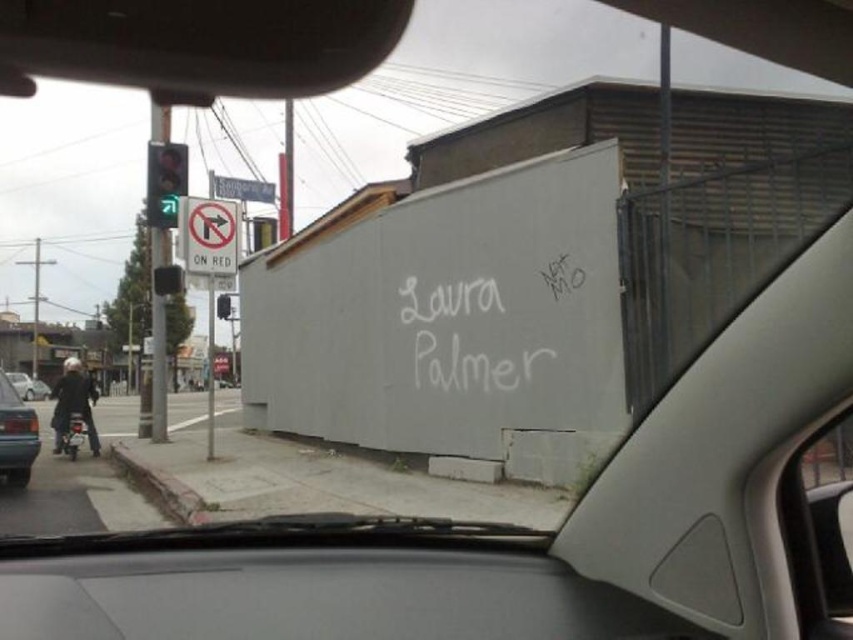
Between white chalk writing at center and green glass traffic light at center, which one is positioned lower?

white chalk writing at center is lower down.

The image size is (853, 640). I want to click on white chalk writing at center, so click(x=461, y=337).

Describe the element at coordinates (242, 188) in the screenshot. I see `white plastic sign at upper center` at that location.

Can you confirm if white plastic sign at upper center is taller than green glass traffic light at center?

Correct, white plastic sign at upper center is much taller as green glass traffic light at center.

Which is in front, point (264, 198) or point (229, 305)?

Point (229, 305) is more forward.

I want to click on white plastic sign at upper center, so click(242, 188).

Is point (469, 316) positioned in front of point (229, 211)?

Yes.

Between point (456, 388) and point (224, 257), which one is positioned in front?

Point (456, 388) is more forward.

You are a GUI agent. You are given a task and a screenshot of the screen. Output one action in this format:
    pyautogui.click(x=<x>, y=<y>)
    Task: Click on the white chalk writing at center
    
    Given the screenshot: What is the action you would take?
    pyautogui.click(x=461, y=337)